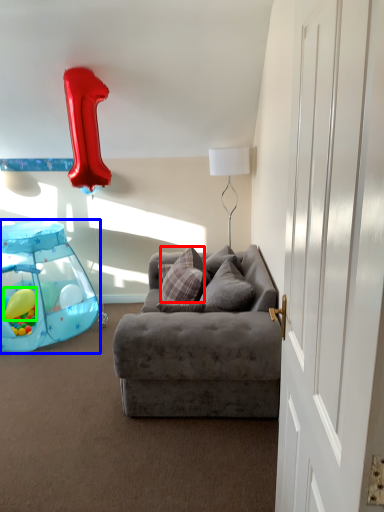
Question: Which object is positioned closest to pillow (highlighted by a red box)? Select from baby carriage (highlighted by a blue box) and balloon (highlighted by a green box).

Choices:
 (A) baby carriage
 (B) balloon

Answer: (A)